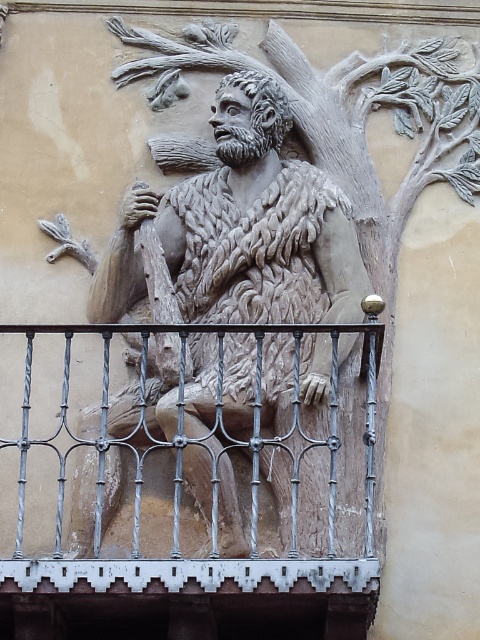
Where is `carved stone figure at center`? This screenshot has width=480, height=640. carved stone figure at center is located at coordinates (252, 280).

What do you see at coordinates (252, 280) in the screenshot? I see `carved stone figure at center` at bounding box center [252, 280].

Does point (133, 248) come closer to viewer compared to point (213, 472)?

No, (133, 248) is further to viewer.

Identify the location of carved stone figure at center. The image size is (480, 640). (252, 280).